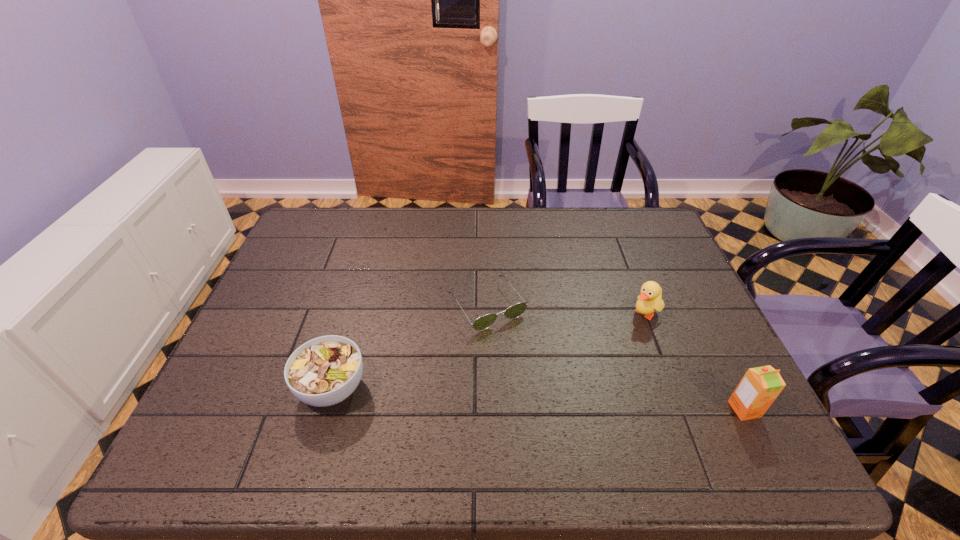
Locate an element on the screen. The width and height of the screenshot is (960, 540). object present at the near right corner is located at coordinates (760, 386).

At what (x,y) coordinates should I click in order to perform the action: click on vacant space at the far edge of the desktop. Please return your answer as a coordinate pair (x, y). Looking at the image, I should click on (411, 211).

What are the coordinates of `vacant region at the near edge` in the screenshot? It's located at (418, 404).

In the image, there is a desktop. Find the location of `vacant space at the left edge`. vacant space at the left edge is located at coordinates (263, 333).

Image resolution: width=960 pixels, height=540 pixels. What are the coordinates of `free space at the right edge of the desktop` in the screenshot? It's located at (669, 343).

Where is `free region at the far left corner`? This screenshot has height=540, width=960. free region at the far left corner is located at coordinates (327, 221).

Where is `vacant region at the far right corner of the desktop`? This screenshot has width=960, height=540. vacant region at the far right corner of the desktop is located at coordinates (621, 246).

At what (x,y) coordinates should I click in order to perform the action: click on free space between the shortest object and the duckling. Please return your answer as a coordinate pair (x, y). The image size is (960, 540). Looking at the image, I should click on (565, 309).

This screenshot has height=540, width=960. I want to click on vacant area that lies between the sunglasses and the duckling, so click(565, 309).

Find the location of a particular element. This screenshot has height=540, width=960. vacant point located between the third shortest object and the shortest object is located at coordinates (565, 309).